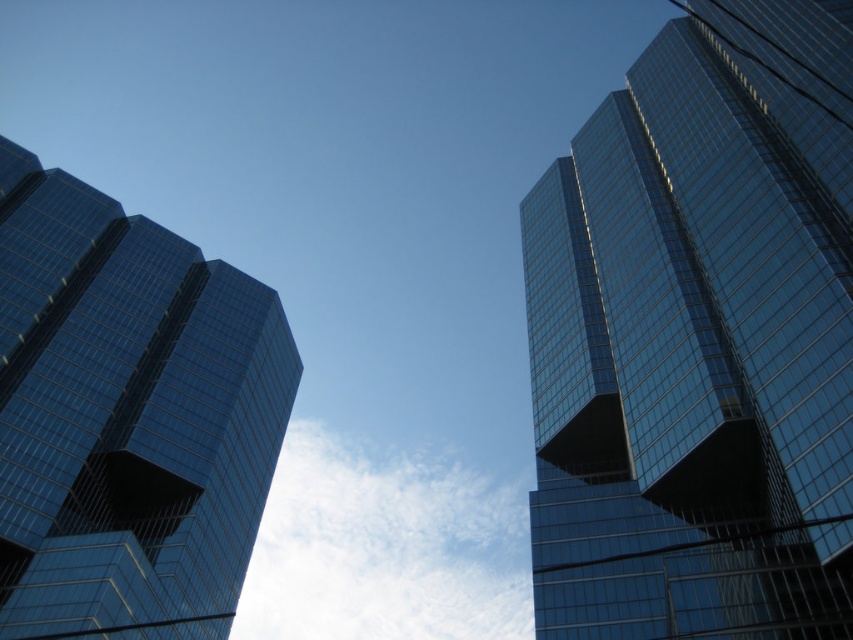
Question: Among these points, which one is farthest from the camera?

Choices:
 (A) pos(262,464)
 (B) pos(537,468)

Answer: (A)

Question: Which point appears closest to the camera in this image?

Choices:
 (A) (660, 196)
 (B) (183, 340)

Answer: (A)

Question: Is the position of glossy glass skyscraper at upper right more distant than that of shiny glass building at left?

Choices:
 (A) yes
 (B) no

Answer: (A)

Question: Does glossy glass skyscraper at upper right appear on the right side of shiny glass building at left?

Choices:
 (A) yes
 (B) no

Answer: (A)

Question: Does glossy glass skyscraper at upper right appear on the right side of shiny glass building at left?

Choices:
 (A) yes
 (B) no

Answer: (A)

Question: Which point appears farthest from the camera in this image?

Choices:
 (A) (227, 328)
 (B) (677, 97)

Answer: (A)